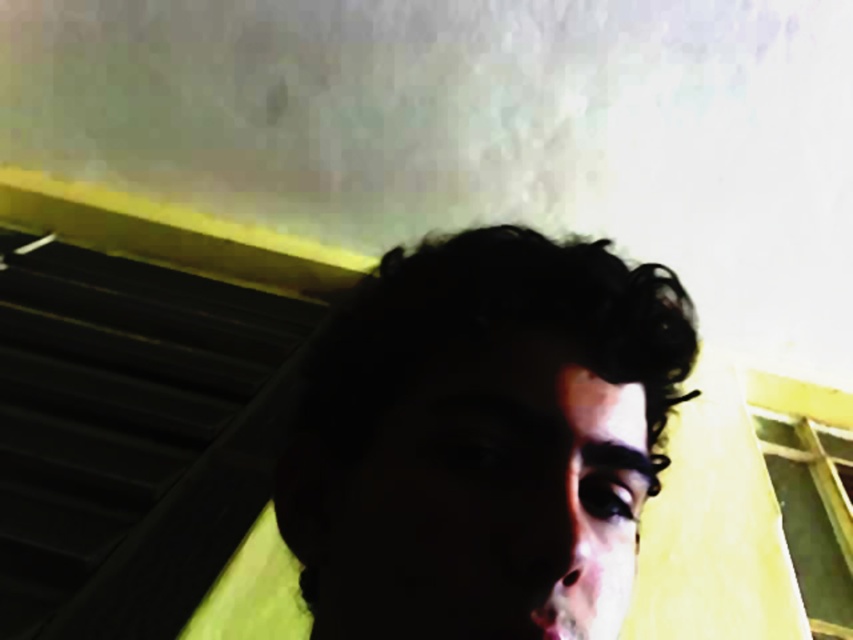
You are trying to determine if your dark curly hair at center can cover the black plastic stair at upper left in the background. Based on their thickness, can your hair cover the stair?

The dark curly hair at center is thinner than the black plastic stair at upper left, so it cannot cover the stair completely.

You are taking a selfie and want to ensure your dark curly hair at center is visible in the photo. Based on the lighting described, where should you position yourself relative to the light source?

The dark curly hair at center is illuminated by a light source from above, so positioning yourself under the light source will ensure the hair is well lit and visible.